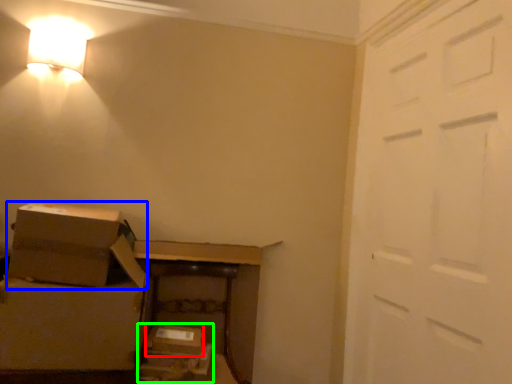
Question: Which object is positioned closest to storage box (highlighted by a red box)? Select from box (highlighted by a blue box) and storage box (highlighted by a green box).

Choices:
 (A) box
 (B) storage box

Answer: (B)